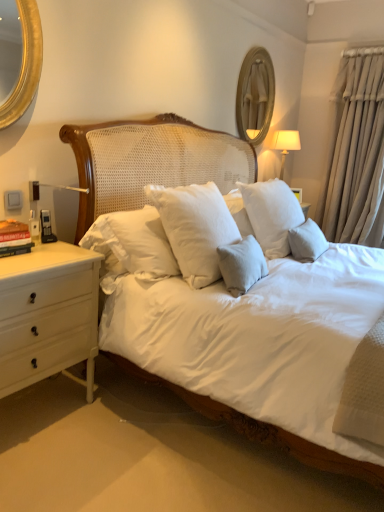
Question: Visually, is beige fabric curtain at right positioned to the left or to the right of white fabric lampshade at upper right?

Choices:
 (A) right
 (B) left

Answer: (A)

Question: Considering the positions of beige fabric curtain at right and white fabric lampshade at upper right in the image, is beige fabric curtain at right bigger or smaller than white fabric lampshade at upper right?

Choices:
 (A) big
 (B) small

Answer: (A)

Question: Which object is positioned closest to the white fabric lampshade at upper right?

Choices:
 (A) hardcover book at left
 (B) wooden framed mirror at upper center
 (C) beige fabric curtain at right

Answer: (B)

Question: Based on their relative distances, which object is nearer to the beige fabric curtain at right?

Choices:
 (A) hardcover book at left
 (B) wooden framed mirror at upper center
 (C) white fabric lampshade at upper right

Answer: (C)